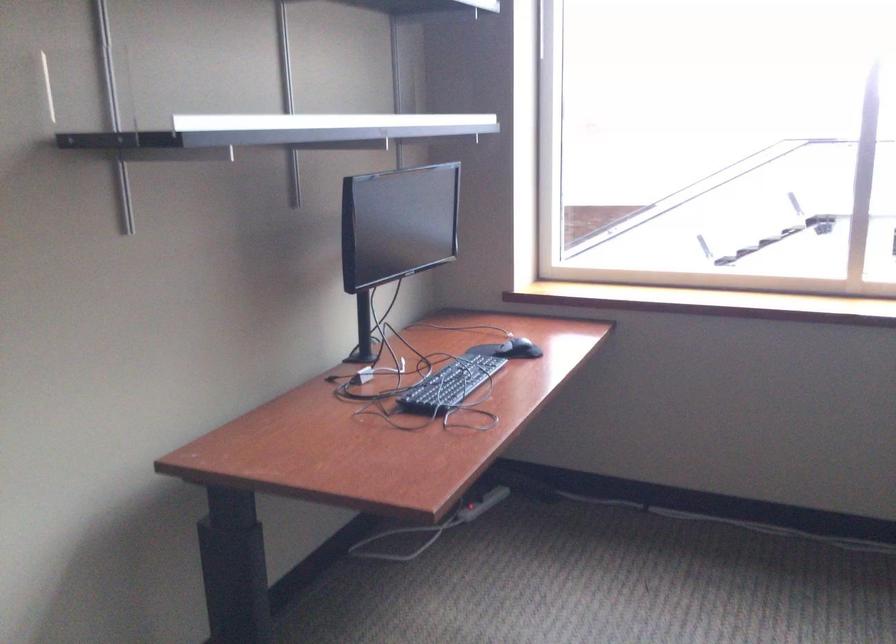
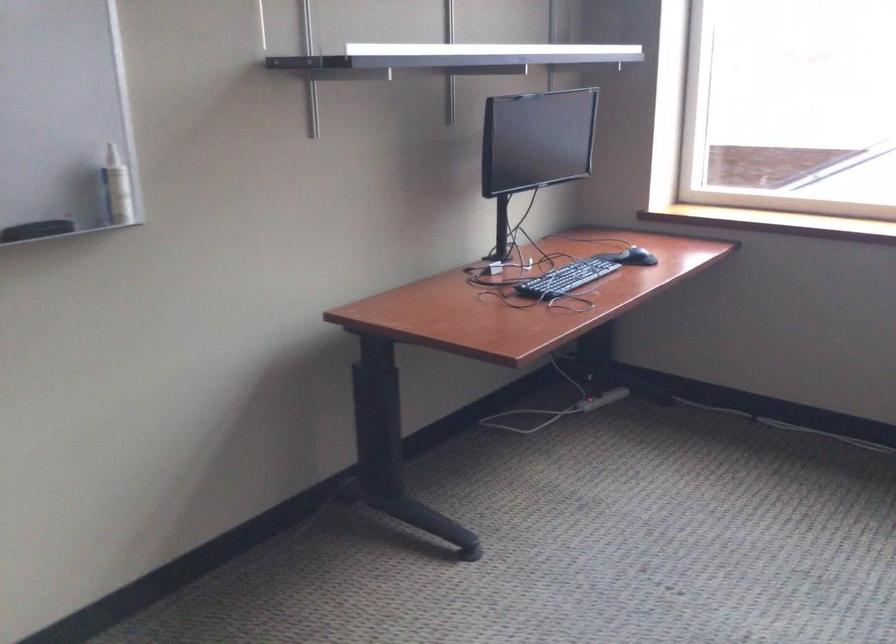
Find the pixel in the second image that matches [520,351] in the first image.

(636, 257)